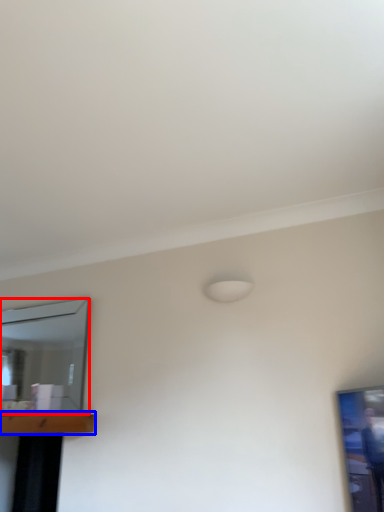
Question: Which object appears farthest to the camera in this image, mirror (highlighted by a red box) or table (highlighted by a blue box)?

Choices:
 (A) mirror
 (B) table

Answer: (A)